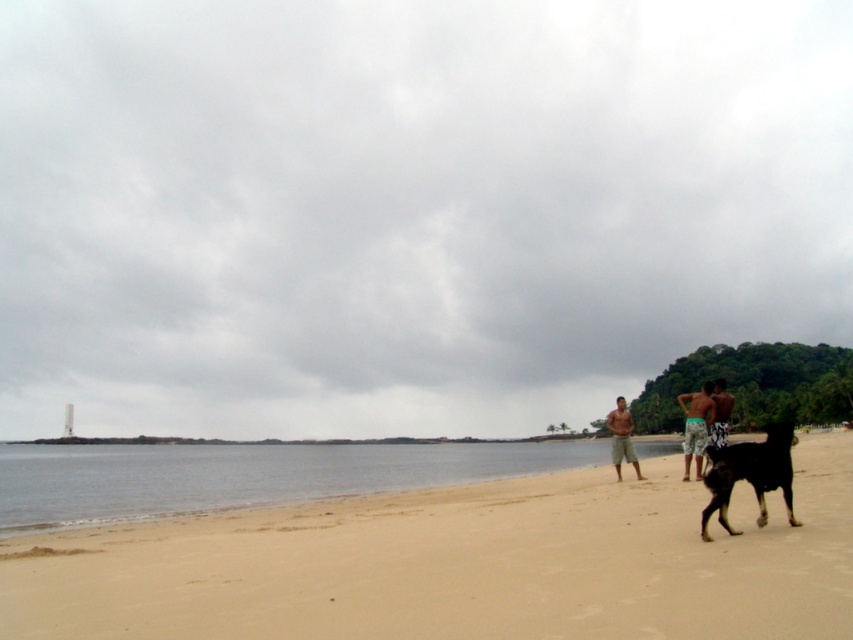
You are a photographer trying to capture the beach scene. You notice the black glossy dog at lower right and the tan shorts at center. Which object should you zoom in on to fill more of the frame?

The tan shorts at center should be zoomed in on because it occupies more space than the black glossy dog at lower right.

You are standing on the beach and see the black glossy dog at lower right and the tan shorts at center. Which object is closer to your right side?

The black glossy dog at lower right is to the left of tan shorts at center, so the tan shorts at center is closer to your right side.

You are standing on the beach and want to walk from the clear water at lower left to the tan shorts at center. Which direction should you move?

You should move to the right because the clear water at lower left is to the left of the tan shorts at center.